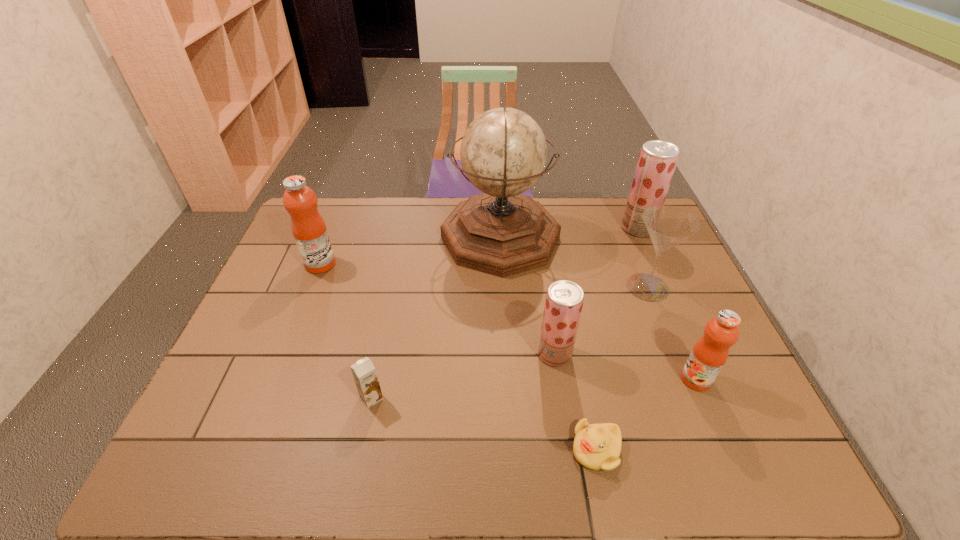
Locate an element on the screen. the seventh object from right to left is located at coordinates (364, 373).

Where is `chocolate milk`? The width and height of the screenshot is (960, 540). chocolate milk is located at coordinates (364, 373).

Where is `duckling`? duckling is located at coordinates (596, 446).

The image size is (960, 540). What are the coordinates of `the nearest object` in the screenshot? It's located at (596, 446).

Image resolution: width=960 pixels, height=540 pixels. Find the location of `vacant area located on the surface of the globe`. vacant area located on the surface of the globe is located at coordinates (388, 238).

Locate an element on the screen. blank space located on the surface of the globe is located at coordinates (325, 238).

The width and height of the screenshot is (960, 540). In order to click on free spot located 0.060m on the surface of the globe in this screenshot , I will do `click(423, 238)`.

You are a GUI agent. You are given a task and a screenshot of the screen. Output one action in this format:
    pyautogui.click(x=<x>, y=<y>)
    Task: Click on the vacant region located 0.110m on the back of the bigger strawberry fruit juice
    The width and height of the screenshot is (960, 540).
    Given the screenshot: What is the action you would take?
    pyautogui.click(x=626, y=201)

At what (x,y) coordinates should I click in order to perform the action: click on vacant region located on the front label of the farther orange fruit juice. Please return your answer as a coordinate pair (x, y). The width and height of the screenshot is (960, 540). Looking at the image, I should click on (434, 264).

This screenshot has height=540, width=960. Identify the location of free region located 0.070m on the back of the flute glass. (636, 256).